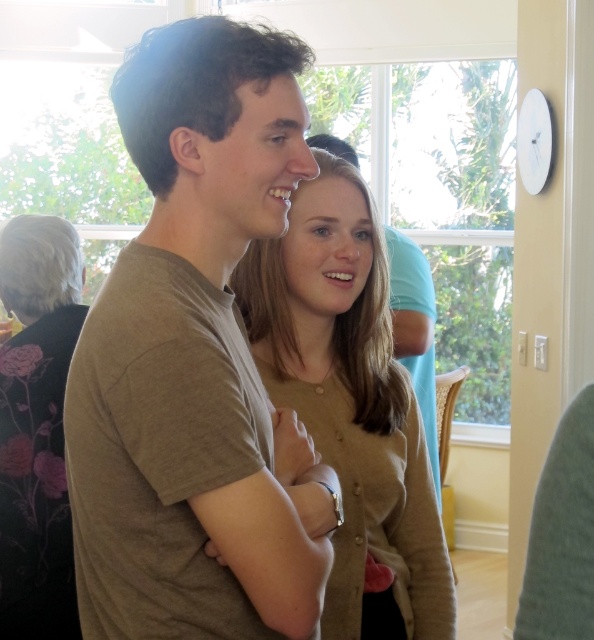
Question: Can you confirm if matte brown t-shirt at center is positioned to the right of matte beige cardigan at center?

Choices:
 (A) yes
 (B) no

Answer: (B)

Question: Which object is closer to the camera taking this photo?

Choices:
 (A) matte beige cardigan at center
 (B) matte brown t-shirt at center
 (C) black floral dress at left

Answer: (B)

Question: Which point is farther to the camera?

Choices:
 (A) black floral dress at left
 (B) matte brown t-shirt at center

Answer: (A)

Question: Which of the following is the closest to the observer?

Choices:
 (A) matte brown t-shirt at center
 (B) matte beige cardigan at center
 (C) matte brown shirt at center
 (D) black floral dress at left

Answer: (A)

Question: Is matte brown t-shirt at center positioned in front of matte beige cardigan at center?

Choices:
 (A) no
 (B) yes

Answer: (B)

Question: Does matte brown t-shirt at center come behind matte beige cardigan at center?

Choices:
 (A) no
 (B) yes

Answer: (A)